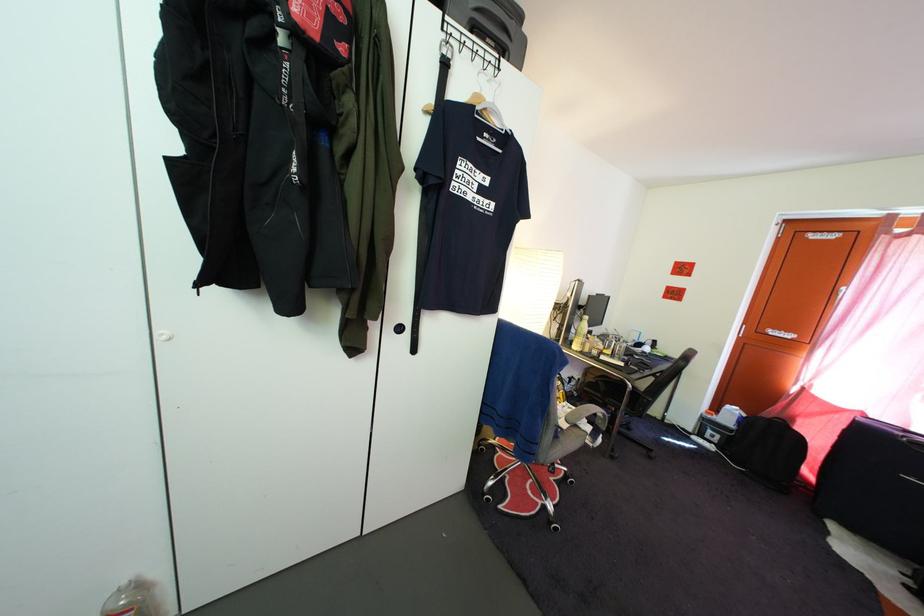
Describe the element at coordinates (398, 328) in the screenshot. This screenshot has height=616, width=924. I see `the black cabinet knob` at that location.